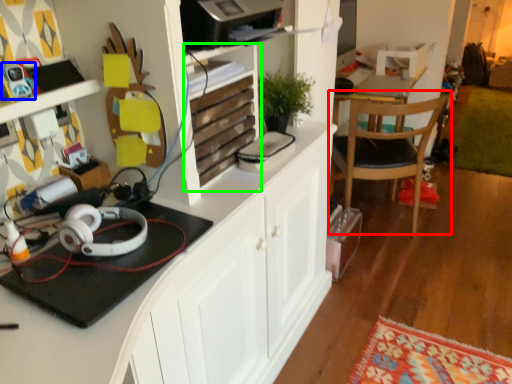
Question: Which object is positioned closest to chair (highlighted by a red box)? Select from toy (highlighted by a blue box) and shelf (highlighted by a green box).

Choices:
 (A) toy
 (B) shelf

Answer: (B)